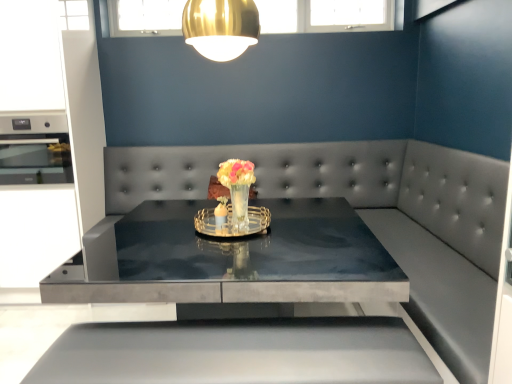
Question: Would you consider translucent glass vase at center, arranged as the 2th floral arrangement when viewed from the back, to be distant from gold metallic lampshade at upper center?

Choices:
 (A) yes
 (B) no

Answer: (B)

Question: Would you say translucent glass vase at center, placed as the 1th floral arrangement when sorted from front to back, is outside gold metallic lampshade at upper center?

Choices:
 (A) yes
 (B) no

Answer: (A)

Question: Would you say gold metallic lampshade at upper center is part of translucent glass vase at center, placed as the 1th floral arrangement when sorted from front to back,'s contents?

Choices:
 (A) yes
 (B) no

Answer: (B)

Question: Can you confirm if translucent glass vase at center, placed as the 1th floral arrangement when sorted from front to back, is wider than gold metallic lampshade at upper center?

Choices:
 (A) no
 (B) yes

Answer: (A)

Question: From a real-world perspective, does translucent glass vase at center, placed as the 1th floral arrangement when sorted from front to back, sit lower than gold metallic lampshade at upper center?

Choices:
 (A) yes
 (B) no

Answer: (A)

Question: Considering the positions of point 226,13 and point 156,269, is point 226,13 closer or farther from the camera than point 156,269?

Choices:
 (A) closer
 (B) farther

Answer: (B)

Question: From their relative heights in the image, would you say gold metallic lampshade at upper center is taller or shorter than smooth gray couch at center?

Choices:
 (A) tall
 (B) short

Answer: (B)

Question: Based on their sizes in the image, would you say gold metallic lampshade at upper center is bigger or smaller than smooth gray couch at center?

Choices:
 (A) small
 (B) big

Answer: (A)

Question: From the image's perspective, is gold metallic lampshade at upper center positioned above or below smooth gray couch at center?

Choices:
 (A) below
 (B) above

Answer: (B)

Question: From their relative heights in the image, would you say smooth gray couch at center is taller or shorter than gold metallic lampshade at upper center?

Choices:
 (A) short
 (B) tall

Answer: (B)

Question: Is point (413, 183) positioned closer to the camera than point (246, 3)?

Choices:
 (A) closer
 (B) farther

Answer: (B)

Question: From a real-world perspective, relative to gold metallic lampshade at upper center, is smooth gray couch at center vertically above or below?

Choices:
 (A) above
 (B) below

Answer: (B)

Question: Considering their positions, is smooth gray couch at center located in front of or behind gold metallic lampshade at upper center?

Choices:
 (A) behind
 (B) front

Answer: (B)

Question: Considering the relative positions of smooth gray couch at center and translucent glass vase at center, which is the first floral arrangement from back to front, in the image provided, is smooth gray couch at center to the left or to the right of translucent glass vase at center, which is the first floral arrangement from back to front,?

Choices:
 (A) left
 (B) right

Answer: (B)

Question: Is point (113, 296) positioned closer to the camera than point (252, 223)?

Choices:
 (A) farther
 (B) closer

Answer: (B)